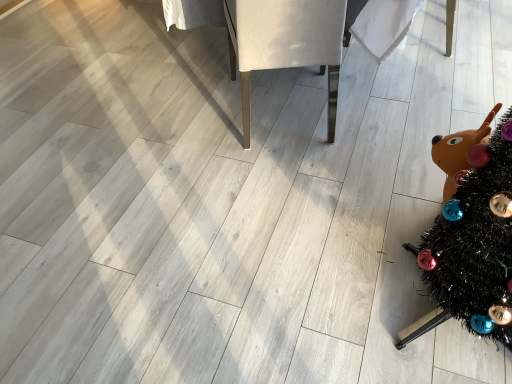
The image size is (512, 384). Identify the location of vacant space situated on the left part of white fabric chair at center. (175, 122).